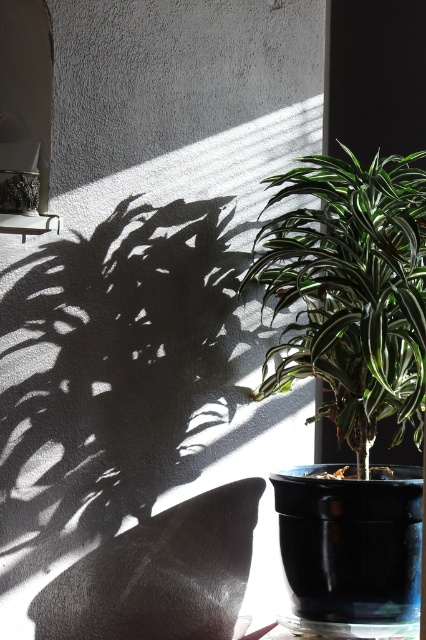
You are standing in the room looking at the potted plant. There are two points marked in the image. The first point is at coordinates point (368, 337) and the second is at point (16, 164). Which point is nearer to your eyes?

Point (368, 337) is closer to the camera than point (16, 164), so the first point is nearer to your eyes.

From the picture: You are an interior designer assessing the space for a new piece of furniture. You notice the green glossy plant at center and the metallic frame at upper left. Which object occupies more horizontal space in the scene?

The green glossy plant at center occupies more horizontal space than the metallic frame at upper left because its width is larger.

You are an interior designer planning to place a new painting on the wall behind the green glossy plant at center. The painting is 1 meter wide and must be centered exactly above the plant. Given the plant is at coordinates point 0.456, 0.824, what are the coordinates where the bottom edge of the painting should be placed to ensure it is centered above the plant?

To center the painting above the green glossy plant at center, the bottom edge of the painting should be placed at the same x coordinate as the plant, which is 0.456. The y coordinate would depend on the height of the painting, but since the plant is at 0.824, the bottom edge should be slightly above that point to ensure it is centered above the plant.